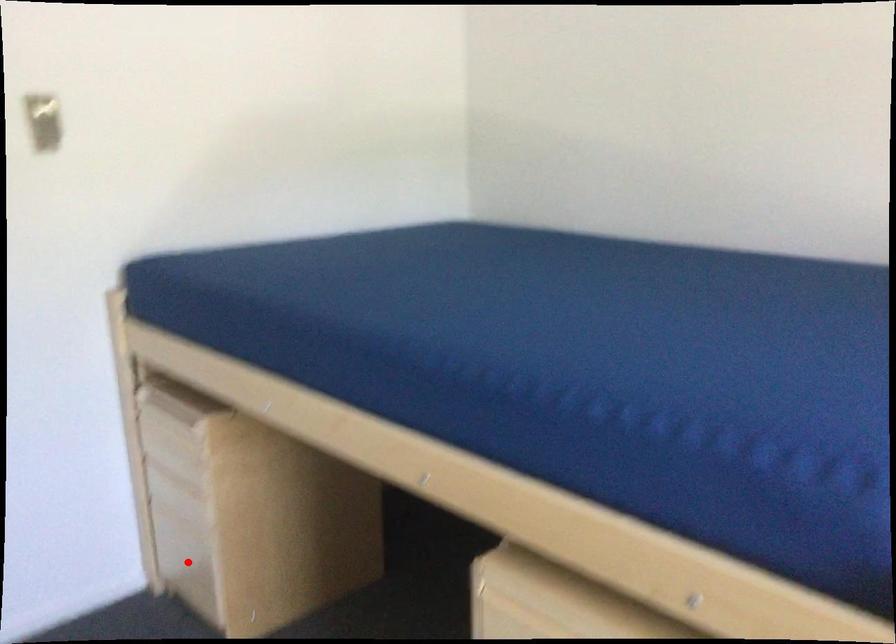
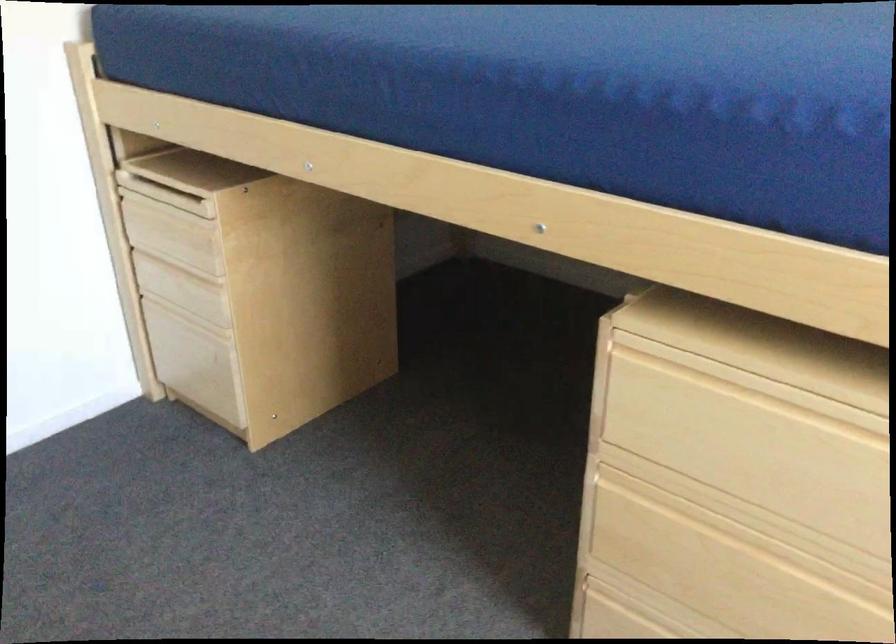
Locate, in the second image, the point that corresponds to the highlighted location in the first image.

(195, 361)